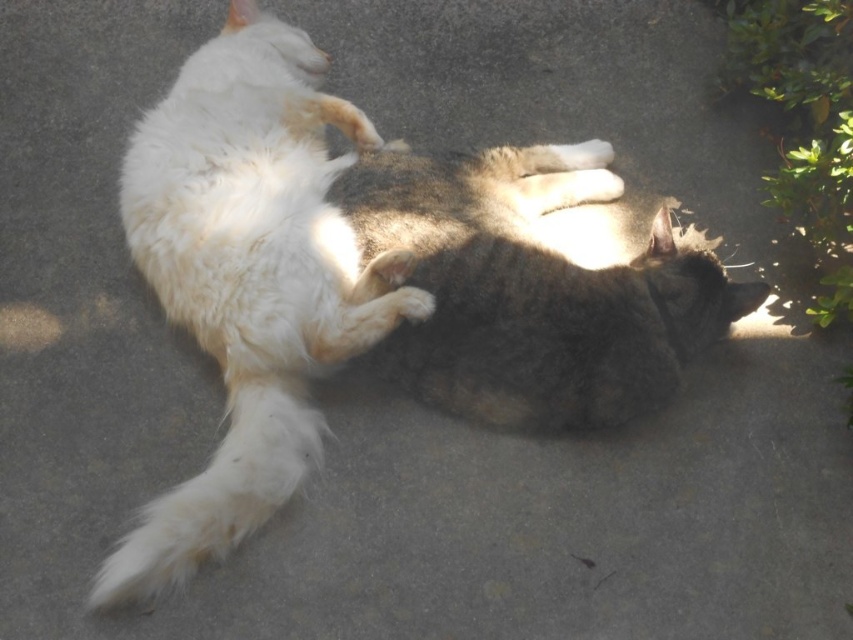
Question: Can you confirm if white fluffy cat at left is positioned above gray-furred cat at center?

Choices:
 (A) yes
 (B) no

Answer: (B)

Question: Which object is positioned closest to the gray-furred cat at center?

Choices:
 (A) white fluffy paw at center
 (B) white fluffy cat at left

Answer: (A)

Question: Which object is farther from the camera taking this photo?

Choices:
 (A) white fluffy cat at left
 (B) white fluffy paw at center
 (C) gray-furred cat at center

Answer: (C)

Question: In this image, where is gray-furred cat at center located relative to white fluffy paw at center?

Choices:
 (A) right
 (B) left

Answer: (A)

Question: Which is nearer to the white fluffy paw at center?

Choices:
 (A) gray-furred cat at center
 (B) white fluffy cat at left

Answer: (A)

Question: Where is gray-furred cat at center located in relation to white fluffy paw at center in the image?

Choices:
 (A) above
 (B) below

Answer: (A)